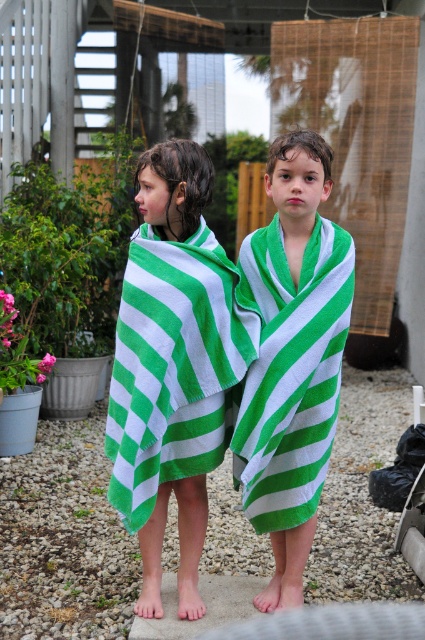
Question: Does green striped towel at left have a lesser width compared to green striped towel at center?

Choices:
 (A) no
 (B) yes

Answer: (A)

Question: Is the position of green striped towel at left less distant than that of green striped towel at center?

Choices:
 (A) no
 (B) yes

Answer: (B)

Question: Which object appears farthest from the camera in this image?

Choices:
 (A) green striped towel at left
 (B) green striped towel at center

Answer: (B)

Question: Is green striped towel at left positioned before green striped towel at center?

Choices:
 (A) no
 (B) yes

Answer: (B)